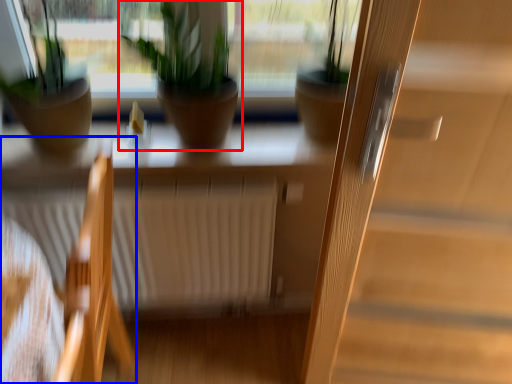
Question: Which of the following is the farthest to the observer, houseplant (highlighted by a red box) or chair (highlighted by a blue box)?

Choices:
 (A) houseplant
 (B) chair

Answer: (A)